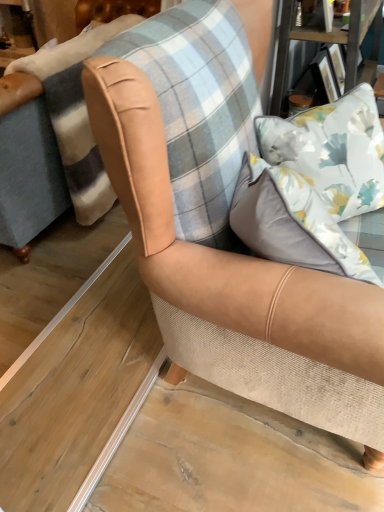
The width and height of the screenshot is (384, 512). What do you see at coordinates (292, 222) in the screenshot? I see `white satin pillow at upper right, positioned as the second pillow in back-to-front order` at bounding box center [292, 222].

Image resolution: width=384 pixels, height=512 pixels. What do you see at coordinates (219, 250) in the screenshot?
I see `tan leather armchair at center` at bounding box center [219, 250].

This screenshot has height=512, width=384. What do you see at coordinates (332, 151) in the screenshot?
I see `floral fabric pillow at upper right, marked as the first pillow in a back-to-front arrangement` at bounding box center [332, 151].

Measure the distance between floral fabric pillow at upper right, marked as the first pillow in a back-to-front arrangement, and camera.

They are 3.54 feet apart.

Where is `white satin pillow at upper right, positioned as the second pillow in back-to-front order`? This screenshot has height=512, width=384. white satin pillow at upper right, positioned as the second pillow in back-to-front order is located at coordinates (292, 222).

Does tan leather armchair at center have a greater width compared to white satin pillow at upper right, positioned as the first pillow in front-to-back order?

Yes, tan leather armchair at center is wider than white satin pillow at upper right, positioned as the first pillow in front-to-back order.

From the image's perspective, is tan leather armchair at center on white satin pillow at upper right, positioned as the second pillow in back-to-front order?

No.

Is point (343, 305) in front of point (299, 182)?

Yes, point (343, 305) is in front of point (299, 182).

Is tan leather armchair at center positioned beyond the bounds of white satin pillow at upper right, positioned as the first pillow in front-to-back order?

That's correct, tan leather armchair at center is outside of white satin pillow at upper right, positioned as the first pillow in front-to-back order.

Is floral fabric pillow at upper right, marked as the first pillow in a back-to-front arrangement, facing away from white satin pillow at upper right, positioned as the second pillow in back-to-front order?

No, white satin pillow at upper right, positioned as the second pillow in back-to-front order, is not at the back of floral fabric pillow at upper right, marked as the first pillow in a back-to-front arrangement.

Relative to white satin pillow at upper right, positioned as the first pillow in front-to-back order, is floral fabric pillow at upper right, the 2th pillow when ordered from front to back, in front or behind?

Clearly, floral fabric pillow at upper right, the 2th pillow when ordered from front to back, is behind white satin pillow at upper right, positioned as the first pillow in front-to-back order.

Considering the positions of objects floral fabric pillow at upper right, the 2th pillow when ordered from front to back, and white satin pillow at upper right, positioned as the second pillow in back-to-front order, in the image provided, who is more to the right, floral fabric pillow at upper right, the 2th pillow when ordered from front to back, or white satin pillow at upper right, positioned as the second pillow in back-to-front order,?

floral fabric pillow at upper right, the 2th pillow when ordered from front to back, is more to the right.

From a real-world perspective, is white satin pillow at upper right, positioned as the first pillow in front-to-back order, positioned under floral fabric pillow at upper right, the 2th pillow when ordered from front to back, based on gravity?

No.

What's the angular difference between white satin pillow at upper right, positioned as the second pillow in back-to-front order, and floral fabric pillow at upper right, marked as the first pillow in a back-to-front arrangement,'s facing directions?

They differ by 37.5 degrees in their facing directions.

Is white satin pillow at upper right, positioned as the first pillow in front-to-back order, facing towards floral fabric pillow at upper right, the 2th pillow when ordered from front to back?

No, white satin pillow at upper right, positioned as the first pillow in front-to-back order, is not facing towards floral fabric pillow at upper right, the 2th pillow when ordered from front to back.

Is point (285, 193) positioned after point (379, 141)?

No, (285, 193) is closer to viewer.

Where is `pillow that is behind the tan leather armchair at center`? pillow that is behind the tan leather armchair at center is located at coordinates (332, 151).

Which of these two, floral fabric pillow at upper right, the 2th pillow when ordered from front to back, or tan leather armchair at center, is wider?

tan leather armchair at center.

From the image's perspective, which one is positioned higher, floral fabric pillow at upper right, the 2th pillow when ordered from front to back, or tan leather armchair at center?

From the image's view, floral fabric pillow at upper right, the 2th pillow when ordered from front to back, is above.

Between point (331, 110) and point (153, 262), which one is positioned behind?

The point (331, 110) is farther from the camera.

Is white satin pillow at upper right, positioned as the first pillow in front-to-back order, bigger than tan leather armchair at center?

Actually, white satin pillow at upper right, positioned as the first pillow in front-to-back order, might be smaller than tan leather armchair at center.

From a real-world perspective, is white satin pillow at upper right, positioned as the second pillow in back-to-front order, on top of tan leather armchair at center?

Correct, in the physical world, white satin pillow at upper right, positioned as the second pillow in back-to-front order, is higher than tan leather armchair at center.

Considering the sizes of objects tan leather armchair at center and floral fabric pillow at upper right, marked as the first pillow in a back-to-front arrangement, in the image provided, who is bigger, tan leather armchair at center or floral fabric pillow at upper right, marked as the first pillow in a back-to-front arrangement,?

Bigger between the two is floral fabric pillow at upper right, marked as the first pillow in a back-to-front arrangement.

Are tan leather armchair at center and floral fabric pillow at upper right, marked as the first pillow in a back-to-front arrangement, located far from each other?

tan leather armchair at center is actually quite close to floral fabric pillow at upper right, marked as the first pillow in a back-to-front arrangement.

Is tan leather armchair at center completely or partially outside of floral fabric pillow at upper right, the 2th pillow when ordered from front to back?

Absolutely, tan leather armchair at center is external to floral fabric pillow at upper right, the 2th pillow when ordered from front to back.

From a real-world perspective, count 1st pillows upward from the tan leather armchair at center and point to it. Please provide its 2D coordinates.

[(332, 151)]

I want to click on pillow in front of the tan leather armchair at center, so click(x=292, y=222).

Where is `pillow above the floral fabric pillow at upper right, the 2th pillow when ordered from front to back (from a real-world perspective)`? The image size is (384, 512). pillow above the floral fabric pillow at upper right, the 2th pillow when ordered from front to back (from a real-world perspective) is located at coordinates (292, 222).

Which object lies further to the anchor point floral fabric pillow at upper right, the 2th pillow when ordered from front to back, tan leather armchair at center or white satin pillow at upper right, positioned as the second pillow in back-to-front order?

Among the two, tan leather armchair at center is located further to floral fabric pillow at upper right, the 2th pillow when ordered from front to back.

Estimate the real-world distances between objects in this image. Which object is closer to floral fabric pillow at upper right, marked as the first pillow in a back-to-front arrangement, white satin pillow at upper right, positioned as the second pillow in back-to-front order, or tan leather armchair at center?

The object closer to floral fabric pillow at upper right, marked as the first pillow in a back-to-front arrangement, is white satin pillow at upper right, positioned as the second pillow in back-to-front order.

Considering their positions, is tan leather armchair at center positioned closer to white satin pillow at upper right, positioned as the first pillow in front-to-back order, than floral fabric pillow at upper right, the 2th pillow when ordered from front to back?

The object closer to white satin pillow at upper right, positioned as the first pillow in front-to-back order, is tan leather armchair at center.

Which object lies further to the anchor point tan leather armchair at center, white satin pillow at upper right, positioned as the first pillow in front-to-back order, or floral fabric pillow at upper right, the 2th pillow when ordered from front to back?

Among the two, floral fabric pillow at upper right, the 2th pillow when ordered from front to back, is located further to tan leather armchair at center.

When comparing their distances from tan leather armchair at center, does floral fabric pillow at upper right, marked as the first pillow in a back-to-front arrangement, or white satin pillow at upper right, positioned as the first pillow in front-to-back order, seem further?

floral fabric pillow at upper right, marked as the first pillow in a back-to-front arrangement.

Looking at the image, which one is located further to white satin pillow at upper right, positioned as the second pillow in back-to-front order, floral fabric pillow at upper right, marked as the first pillow in a back-to-front arrangement, or tan leather armchair at center?

floral fabric pillow at upper right, marked as the first pillow in a back-to-front arrangement, is further to white satin pillow at upper right, positioned as the second pillow in back-to-front order.

Identify the location of pillow that lies between floral fabric pillow at upper right, marked as the first pillow in a back-to-front arrangement, and tan leather armchair at center from top to bottom. (292, 222).